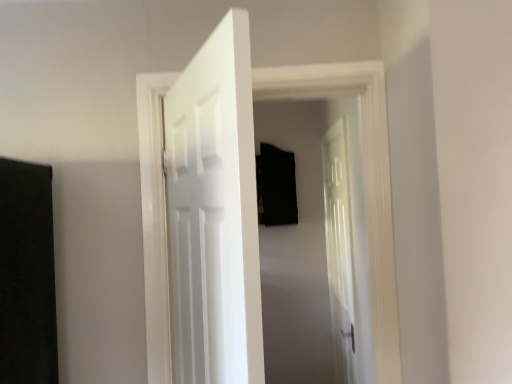
Where is `white wooden door at center, arranged as the second door when viewed from the back`? The image size is (512, 384). white wooden door at center, arranged as the second door when viewed from the back is located at coordinates (364, 181).

You are a GUI agent. You are given a task and a screenshot of the screen. Output one action in this format:
    pyautogui.click(x=<x>, y=<y>)
    Task: Click on the white wooden door at center, arranged as the second door when viewed from the front
    The height and width of the screenshot is (384, 512).
    Given the screenshot: What is the action you would take?
    pyautogui.click(x=364, y=181)

How distant is white glossy door at center, the first door when ordered from back to front, from white wooden door at center, the 2th door viewed from the right?

They are 72.65 centimeters apart.

Is white glossy door at center, the first door when ordered from back to front, situated inside white wooden door at center, which is the second door in left-to-right order, or outside?

white glossy door at center, the first door when ordered from back to front, exists outside the volume of white wooden door at center, which is the second door in left-to-right order.

Does white glossy door at center, which is the third door from front to back, appear on the left side of white wooden door at center, arranged as the second door when viewed from the front?

In fact, white glossy door at center, which is the third door from front to back, is to the right of white wooden door at center, arranged as the second door when viewed from the front.

Is the position of white glossy door at center, the first door when ordered from back to front, more distant than that of white wooden door at center, the 2th door viewed from the right?

That is True.

Considering the relative sizes of white glossy door at center, which is the 1th door from left to right, and white glossy door at center, placed as the first door when sorted from right to left, in the image provided, is white glossy door at center, which is the 1th door from left to right, taller than white glossy door at center, placed as the first door when sorted from right to left,?

Incorrect, the height of white glossy door at center, which is the 1th door from left to right, is not larger of that of white glossy door at center, placed as the first door when sorted from right to left.

Is white glossy door at center, which is the 1th door from left to right, positioned behind white glossy door at center, which is the third door from front to back?

No, it is in front of white glossy door at center, which is the third door from front to back.

Is white glossy door at center, arranged as the third door when viewed from the back, wider or thinner than white glossy door at center, placed as the first door when sorted from right to left?

Clearly, white glossy door at center, arranged as the third door when viewed from the back, has less width compared to white glossy door at center, placed as the first door when sorted from right to left.

Consider the image. How many degrees apart are the facing directions of white glossy door at center, arranged as the third door when viewed from the back, and white glossy door at center, which is the third door from front to back?

white glossy door at center, arranged as the third door when viewed from the back, and white glossy door at center, which is the third door from front to back, are facing 155 degrees away from each other.

Which door is the 2nd one when counting from the back of the white glossy door at center, the first door in the front-to-back sequence? Please provide its 2D coordinates.

[(343, 238)]

Considering the sizes of white glossy door at center, the third door from the left, and white glossy door at center, arranged as the 3th door when viewed from the right, in the image, is white glossy door at center, the third door from the left, taller or shorter than white glossy door at center, arranged as the 3th door when viewed from the right,?

Clearly, white glossy door at center, the third door from the left, is taller compared to white glossy door at center, arranged as the 3th door when viewed from the right.

Which is in front, point (359, 179) or point (240, 310)?

Point (240, 310)

From a real-world perspective, does white wooden door at center, arranged as the second door when viewed from the back, sit lower than white glossy door at center, which is the third door from front to back?

No, from a real-world perspective, white wooden door at center, arranged as the second door when viewed from the back, is not beneath white glossy door at center, which is the third door from front to back.

This screenshot has width=512, height=384. I want to click on the 2nd door below the white wooden door at center, the 2th door viewed from the right (from the image's perspective), so click(343, 238).

Which object is thinner, white wooden door at center, which is the second door in left-to-right order, or white glossy door at center, placed as the first door when sorted from right to left?

With smaller width is white wooden door at center, which is the second door in left-to-right order.

Is white wooden door at center, which is the second door in left-to-right order, smaller than white glossy door at center, arranged as the third door when viewed from the back?

Actually, white wooden door at center, which is the second door in left-to-right order, might be larger than white glossy door at center, arranged as the third door when viewed from the back.

From the image's perspective, between white wooden door at center, the 2th door viewed from the right, and white glossy door at center, the first door in the front-to-back sequence, which one is located above?

From the image's view, white wooden door at center, the 2th door viewed from the right, is above.

Would you say white wooden door at center, the 2th door viewed from the right, is a long distance from white glossy door at center, arranged as the third door when viewed from the back?

They are positioned close to each other.

Can we say white wooden door at center, arranged as the second door when viewed from the back, lies outside white glossy door at center, arranged as the third door when viewed from the back?

Yes, white wooden door at center, arranged as the second door when viewed from the back, is outside of white glossy door at center, arranged as the third door when viewed from the back.

Could you tell me if white glossy door at center, the first door in the front-to-back sequence, is turned towards white wooden door at center, arranged as the second door when viewed from the back?

Yes, white glossy door at center, the first door in the front-to-back sequence, is facing white wooden door at center, arranged as the second door when viewed from the back.

Can you tell me how much white glossy door at center, the first door in the front-to-back sequence, and white wooden door at center, which is the second door in left-to-right order, differ in facing direction?

There is a 114-degree angle between the facing directions of white glossy door at center, the first door in the front-to-back sequence, and white wooden door at center, which is the second door in left-to-right order.

From the image's perspective, which object appears higher, white glossy door at center, which is the 1th door from left to right, or white wooden door at center, arranged as the second door when viewed from the front?

white wooden door at center, arranged as the second door when viewed from the front, from the image's perspective.

Is white glossy door at center, the first door in the front-to-back sequence, not close to white wooden door at center, the 2th door viewed from the right?

white glossy door at center, the first door in the front-to-back sequence, is near white wooden door at center, the 2th door viewed from the right, not far away.

From a real-world perspective, count 2nd doors downward from the white wooden door at center, arranged as the second door when viewed from the back, and point to it. Please provide its 2D coordinates.

[(343, 238)]

There is a white glossy door at center, placed as the first door when sorted from right to left. At what (x,y) coordinates should I click in order to perform the action: click on the 1st door above it (from the image's perspective). Please return your answer as a coordinate pair (x, y). Looking at the image, I should click on (214, 213).

Looking at the image, which one is located further to white glossy door at center, arranged as the 3th door when viewed from the right, white glossy door at center, which is the third door from front to back, or white wooden door at center, which is the second door in left-to-right order?

The object further to white glossy door at center, arranged as the 3th door when viewed from the right, is white glossy door at center, which is the third door from front to back.

Which object lies further to the anchor point white glossy door at center, which is the third door from front to back, white glossy door at center, arranged as the 3th door when viewed from the right, or white wooden door at center, the 2th door viewed from the right?

white glossy door at center, arranged as the 3th door when viewed from the right, is further to white glossy door at center, which is the third door from front to back.

When comparing their distances from white wooden door at center, arranged as the second door when viewed from the back, does white glossy door at center, the first door in the front-to-back sequence, or white glossy door at center, which is the third door from front to back, seem closer?

white glossy door at center, the first door in the front-to-back sequence, lies closer to white wooden door at center, arranged as the second door when viewed from the back, than the other object.

Which object lies nearer to the anchor point white wooden door at center, arranged as the second door when viewed from the back, white glossy door at center, the third door from the left, or white glossy door at center, the first door in the front-to-back sequence?

Based on the image, white glossy door at center, the first door in the front-to-back sequence, appears to be nearer to white wooden door at center, arranged as the second door when viewed from the back.

Estimate the real-world distances between objects in this image. Which object is closer to white glossy door at center, which is the third door from front to back, white wooden door at center, arranged as the second door when viewed from the front, or white glossy door at center, arranged as the third door when viewed from the back?

white wooden door at center, arranged as the second door when viewed from the front, is closer to white glossy door at center, which is the third door from front to back.

Looking at the image, which one is located closer to white glossy door at center, arranged as the third door when viewed from the back, white wooden door at center, arranged as the second door when viewed from the back, or white glossy door at center, which is the third door from front to back?

white wooden door at center, arranged as the second door when viewed from the back, is closer to white glossy door at center, arranged as the third door when viewed from the back.

Image resolution: width=512 pixels, height=384 pixels. Identify the location of door between white glossy door at center, arranged as the third door when viewed from the back, and white glossy door at center, placed as the first door when sorted from right to left, in the front-back direction. (364, 181).